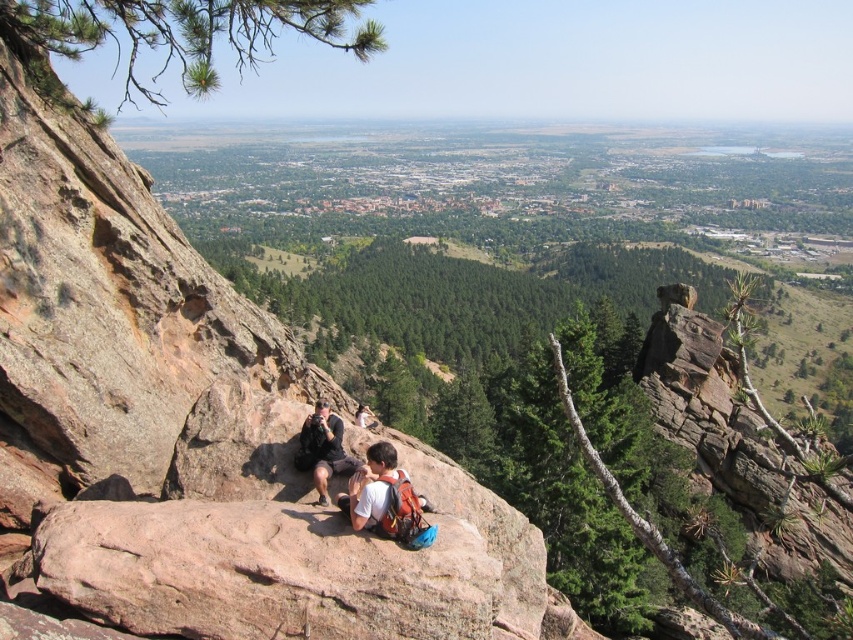
Question: Can you confirm if matte brown backpack at center is bigger than black fabric camera at center?

Choices:
 (A) yes
 (B) no

Answer: (B)

Question: Among these objects, which one is farthest from the camera?

Choices:
 (A) matte brown backpack at center
 (B) rusty rock cliff at center

Answer: (A)

Question: Is rusty rock cliff at center to the left of matte brown backpack at center from the viewer's perspective?

Choices:
 (A) no
 (B) yes

Answer: (B)

Question: From the image, what is the correct spatial relationship of rusty rock cliff at center in relation to matte brown backpack at center?

Choices:
 (A) above
 (B) below

Answer: (A)

Question: Which point is closer to the camera?

Choices:
 (A) (3, 506)
 (B) (416, 504)

Answer: (B)

Question: Which point is closer to the camera taking this photo?

Choices:
 (A) (358, 509)
 (B) (64, 129)
 (C) (344, 470)

Answer: (A)